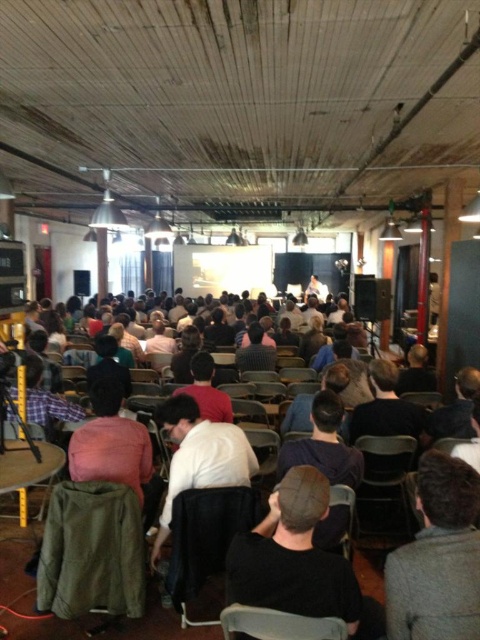
You are an event planner standing at the back of the room and want to ensure there is enough space between the black fabric cap at center and the pink fabric at center for a service aisle. The required minimum distance for the aisle is 3 feet. Can you confirm if the current spacing between them meets this requirement?

The black fabric cap at center is 35.66 inches away from the pink fabric at center. Since 3 feet equals 36 inches, the current distance of 35.66 inches is slightly less than the required 36 inches. Therefore, the spacing does not meet the minimum requirement for the service aisle.